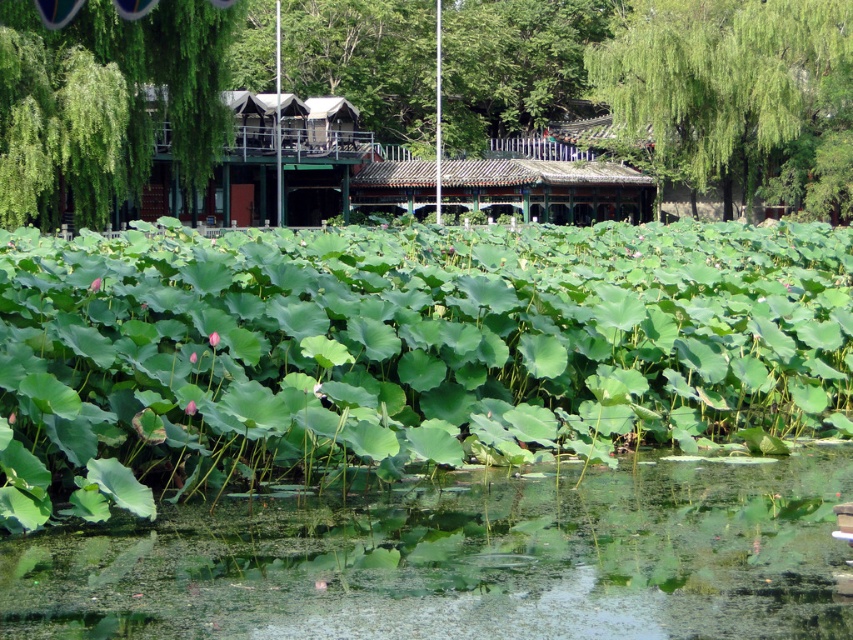
Question: Is green wooden structure at center to the right of brown tiled hut at center from the viewer's perspective?

Choices:
 (A) yes
 (B) no

Answer: (B)

Question: Is the position of green leafy tree at upper left more distant than that of brown tiled hut at center?

Choices:
 (A) no
 (B) yes

Answer: (A)

Question: Can you confirm if green leafy tree at upper right is positioned to the left of green wooden structure at center?

Choices:
 (A) yes
 (B) no

Answer: (B)

Question: Which of the following is the farthest from the observer?

Choices:
 (A) (187, 93)
 (B) (265, 51)
 (C) (798, 168)

Answer: (B)

Question: Which of the following is the closest to the observer?

Choices:
 (A) (769, 51)
 (B) (292, 19)
 (C) (73, 93)

Answer: (C)

Question: Which of the following is the closest to the observer?

Choices:
 (A) (403, 56)
 (B) (120, 81)
 (C) (738, 163)
 (D) (625, 180)

Answer: (B)